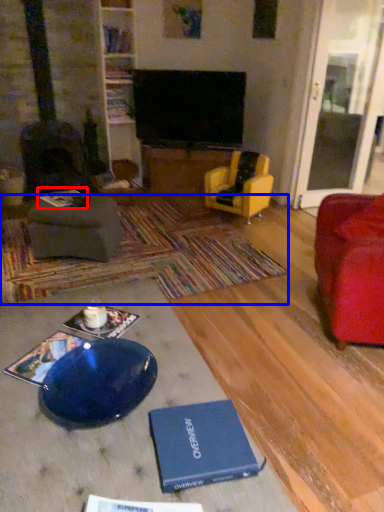
Question: Which point is further to the camera, book (highlighted by a red box) or mat (highlighted by a blue box)?

Choices:
 (A) book
 (B) mat

Answer: (A)